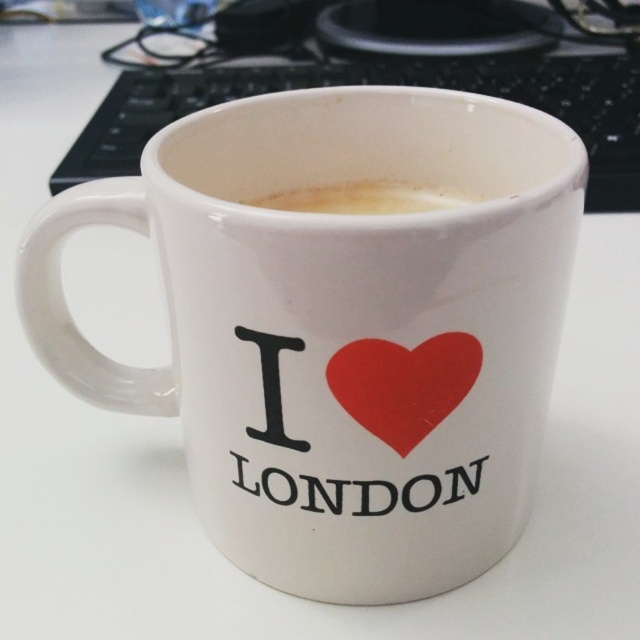
Question: Which point is closer to the camera?

Choices:
 (A) red matte heart at center
 (B) white frothy coffee at center
 (C) white ceramic mug at center

Answer: (C)

Question: Considering the relative positions of white ceramic mug at center and black plastic keyboard at upper center in the image provided, where is white ceramic mug at center located with respect to black plastic keyboard at upper center?

Choices:
 (A) below
 (B) above

Answer: (A)

Question: Estimate the real-world distances between objects in this image. Which object is closer to the red matte heart at center?

Choices:
 (A) white ceramic mug at center
 (B) black plastic keyboard at upper center

Answer: (A)

Question: Which point is closer to the camera?

Choices:
 (A) (292, 204)
 (B) (352, 360)
 (C) (198, 476)
 (D) (54, 182)

Answer: (B)

Question: Can you confirm if white ceramic mug at center is thinner than black plastic keyboard at upper center?

Choices:
 (A) no
 (B) yes

Answer: (B)

Question: Does black plastic keyboard at upper center appear on the right side of red matte heart at center?

Choices:
 (A) no
 (B) yes

Answer: (B)